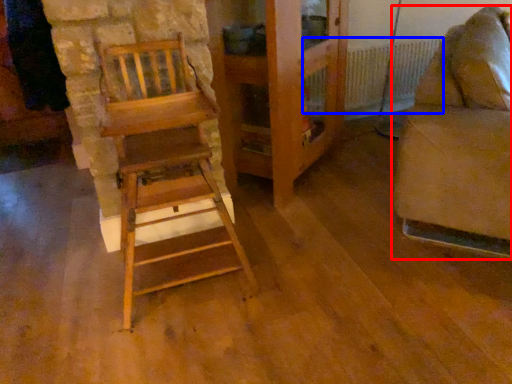
Question: Which object appears closest to the camera in this image, furniture (highlighted by a red box) or radiator (highlighted by a blue box)?

Choices:
 (A) furniture
 (B) radiator

Answer: (A)